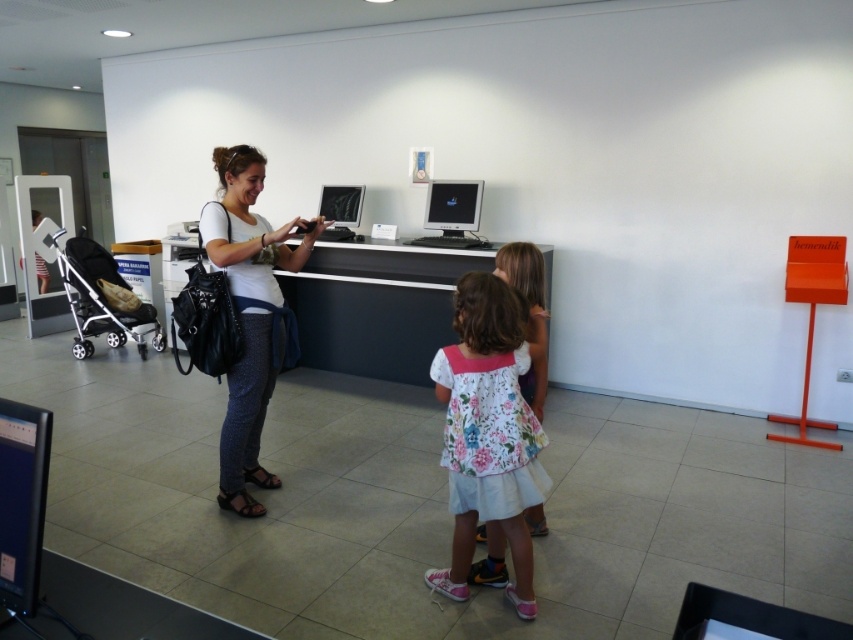
Can you confirm if silver metallic stroller at left is positioned below matte black monitor at center?

Yes, silver metallic stroller at left is below matte black monitor at center.

Is the position of silver metallic stroller at left more distant than that of matte black monitor at center?

Yes, it is.

Measure the distance between silver metallic stroller at left and camera.

silver metallic stroller at left is 18.34 feet away from camera.

This screenshot has width=853, height=640. Find the location of `silver metallic stroller at left`. silver metallic stroller at left is located at coordinates (102, 296).

Locate an element on the screen. This screenshot has width=853, height=640. floral fabric dress at center is located at coordinates (486, 433).

Between point (473, 292) and point (469, 209), which one is positioned behind?

The point (469, 209) is behind.

Identify the location of floral fabric dress at center. This screenshot has width=853, height=640. (486, 433).

Can you confirm if matte black purse at center is wider than silver metallic stroller at left?

No, matte black purse at center is not wider than silver metallic stroller at left.

Who is lower down, matte black purse at center or silver metallic stroller at left?

matte black purse at center is lower down.

Does point (259, 371) come behind point (61, 248)?

No, it is not.

At what (x,y) coordinates should I click in order to perform the action: click on matte black purse at center. Please return your answer as a coordinate pair (x, y). This screenshot has width=853, height=640. Looking at the image, I should click on [x=248, y=314].